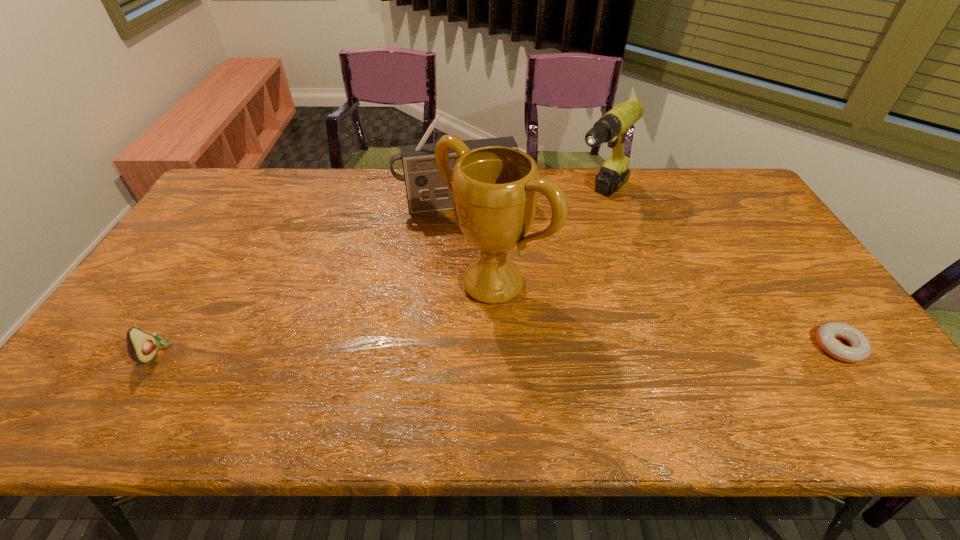
Where is `vacant space on the desktop that is between the leftmost object and the doughnut and is positioned on the front panel of the radio receiver`? vacant space on the desktop that is between the leftmost object and the doughnut and is positioned on the front panel of the radio receiver is located at coordinates pyautogui.click(x=492, y=349).

Image resolution: width=960 pixels, height=540 pixels. What are the coordinates of `free spot on the desktop that is between the second shortest object and the doughnut and is positioned on the front of the tallest object with the decoration` in the screenshot? It's located at (409, 350).

This screenshot has width=960, height=540. Identify the location of vacant space on the desktop that is between the leftmost object and the shortest object and is positioned on the handle side of the drill. (432, 350).